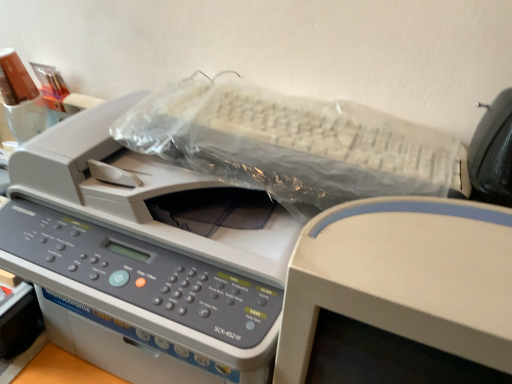
Question: From a real-world perspective, is white plastic monitor at upper center located beneath white plastic printer at center?

Choices:
 (A) yes
 (B) no

Answer: (B)

Question: Considering the relative sizes of white plastic monitor at upper center and white plastic printer at center in the image provided, is white plastic monitor at upper center shorter than white plastic printer at center?

Choices:
 (A) no
 (B) yes

Answer: (A)

Question: Does white plastic monitor at upper center appear on the right side of white plastic printer at center?

Choices:
 (A) yes
 (B) no

Answer: (A)

Question: Is white plastic monitor at upper center taller than white plastic printer at center?

Choices:
 (A) no
 (B) yes

Answer: (B)

Question: Considering the relative sizes of white plastic monitor at upper center and white plastic printer at center in the image provided, is white plastic monitor at upper center wider than white plastic printer at center?

Choices:
 (A) yes
 (B) no

Answer: (B)

Question: Could you tell me if white plastic monitor at upper center is facing white plastic printer at center?

Choices:
 (A) no
 (B) yes

Answer: (A)

Question: Does white plastic printer at center turn towards white plastic monitor at upper center?

Choices:
 (A) no
 (B) yes

Answer: (A)

Question: From a real-world perspective, is white plastic printer at center physically above white plastic monitor at upper center?

Choices:
 (A) yes
 (B) no

Answer: (B)

Question: Is white plastic printer at center facing away from white plastic monitor at upper center?

Choices:
 (A) no
 (B) yes

Answer: (A)

Question: Is the position of white plastic printer at center more distant than that of white plastic monitor at upper center?

Choices:
 (A) yes
 (B) no

Answer: (A)

Question: From a real-world perspective, is white plastic printer at center below white plastic monitor at upper center?

Choices:
 (A) no
 (B) yes

Answer: (B)

Question: Considering the relative sizes of white plastic printer at center and white plastic monitor at upper center in the image provided, is white plastic printer at center shorter than white plastic monitor at upper center?

Choices:
 (A) no
 (B) yes

Answer: (B)

Question: From a real-world perspective, is white plastic monitor at upper center above or below white plastic printer at center?

Choices:
 (A) below
 (B) above

Answer: (B)